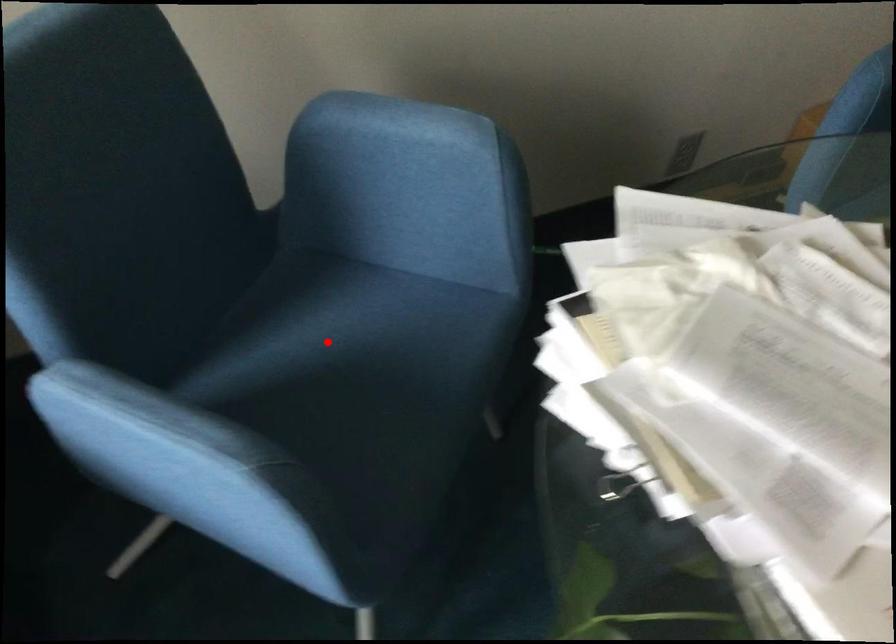
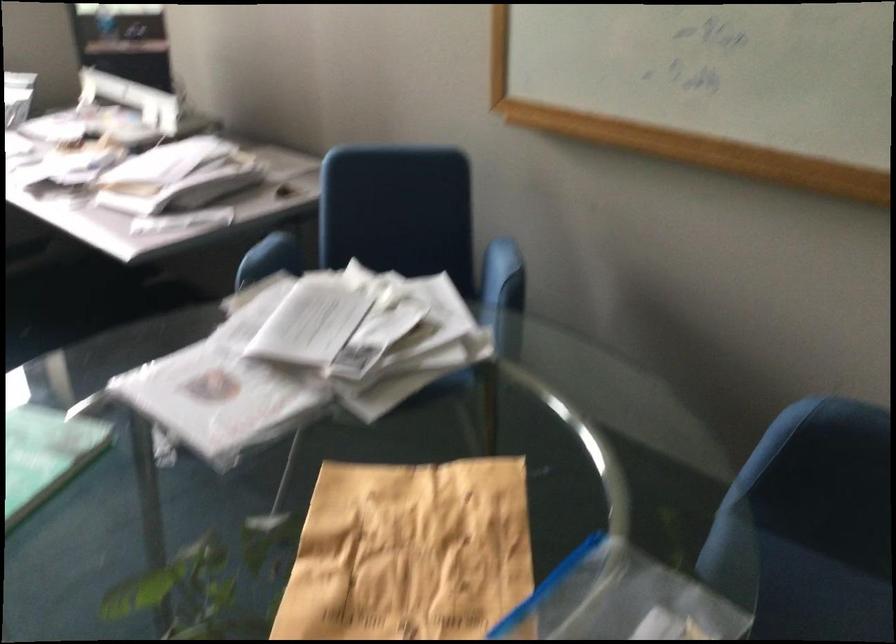
Question: I am providing you with two images of the same scene from different viewpoints. A red point is marked on the first image. Can you still see the location of the red point in image 2?

Choices:
 (A) Yes
 (B) No

Answer: (B)